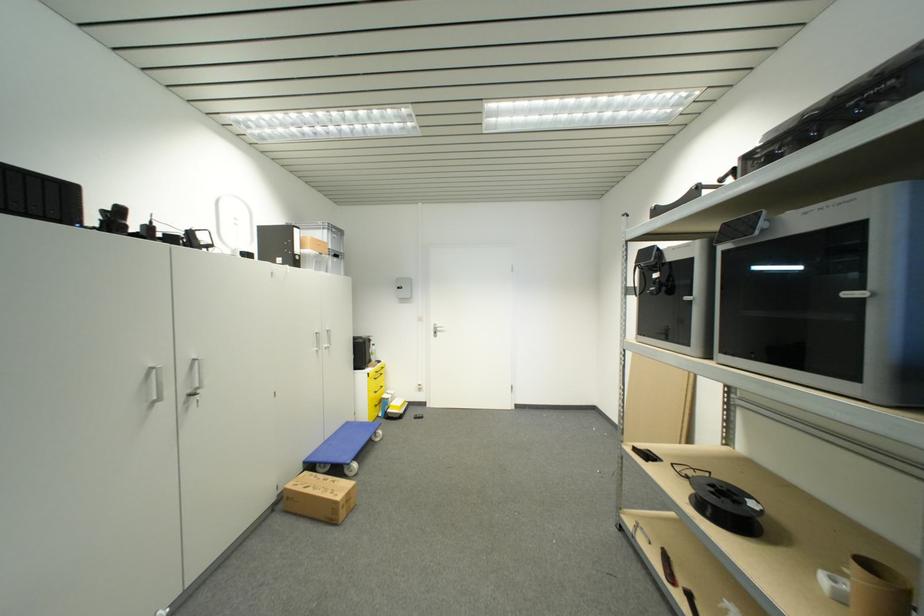
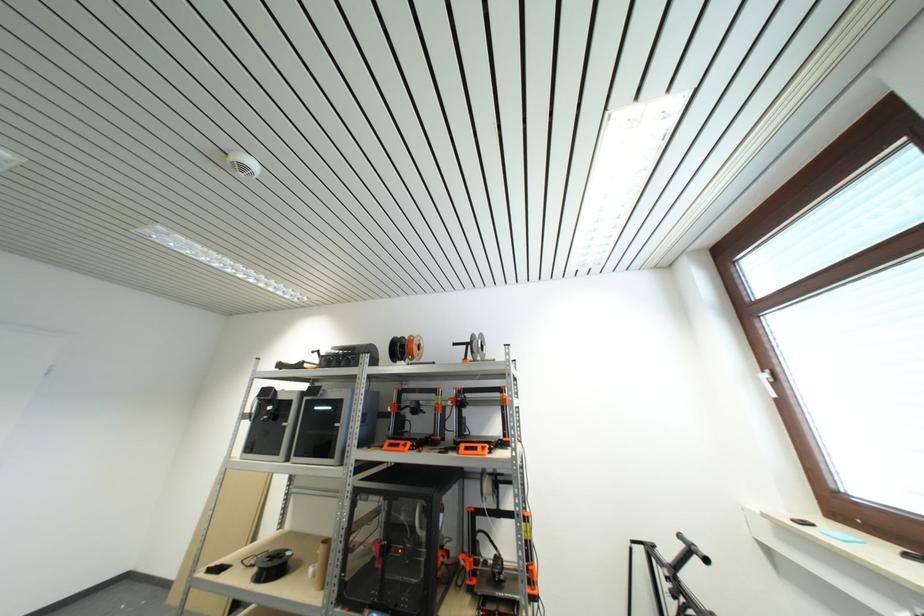
In the second image, find the point that corresponds to [830,583] in the first image.

(314, 573)